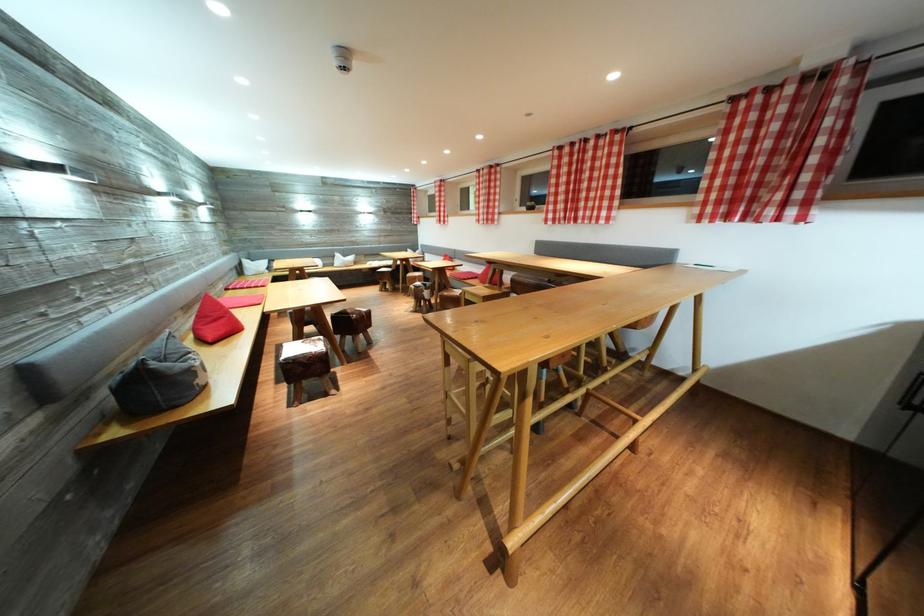
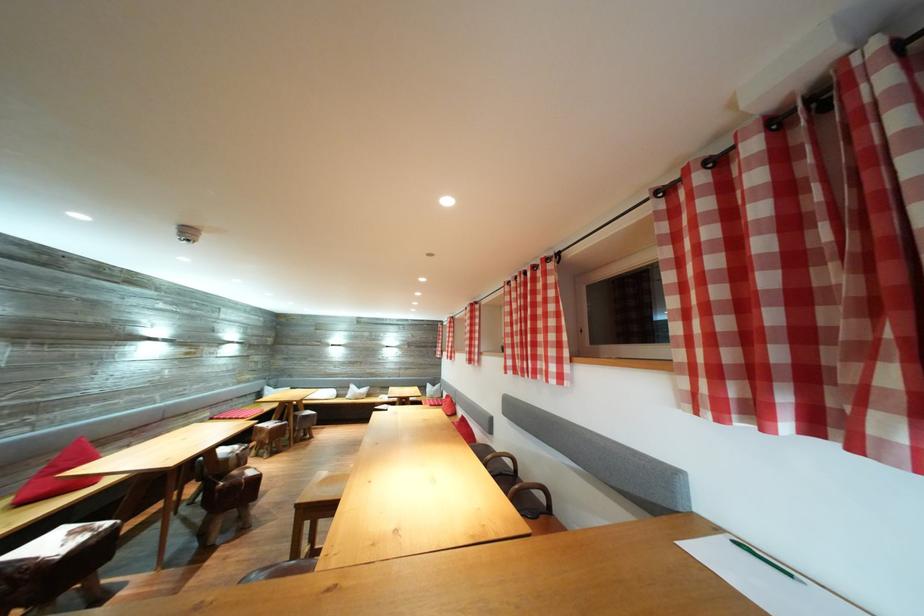
Question: I am providing you with two images of the same scene from different viewpoints. Please identify which objects are invisible in image2.

Choices:
 (A) chair sitting surface
 (B) cowhide stool
 (C) red checkered curtain
 (D) beige hat

Answer: (B)